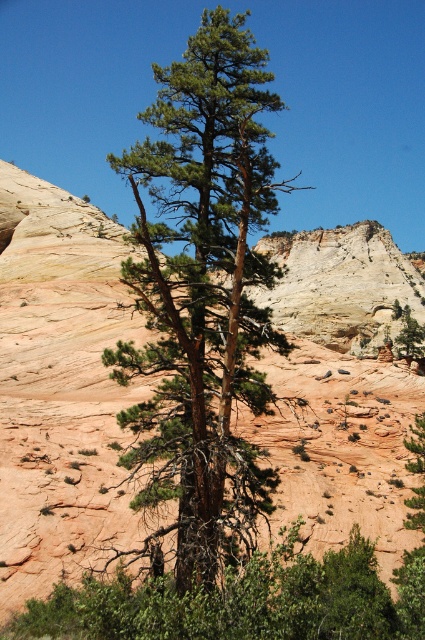
Can you confirm if matte brown rock at center is shorter than green needle-like tree at center?

Yes.

Does matte brown rock at center appear on the left side of green needle-like tree at center?

Indeed, matte brown rock at center is positioned on the left side of green needle-like tree at center.

Measure the distance between point (22, 586) and camera.

The distance of point (22, 586) from camera is 57.59 meters.

The height and width of the screenshot is (640, 425). Identify the location of matte brown rock at center. (62, 388).